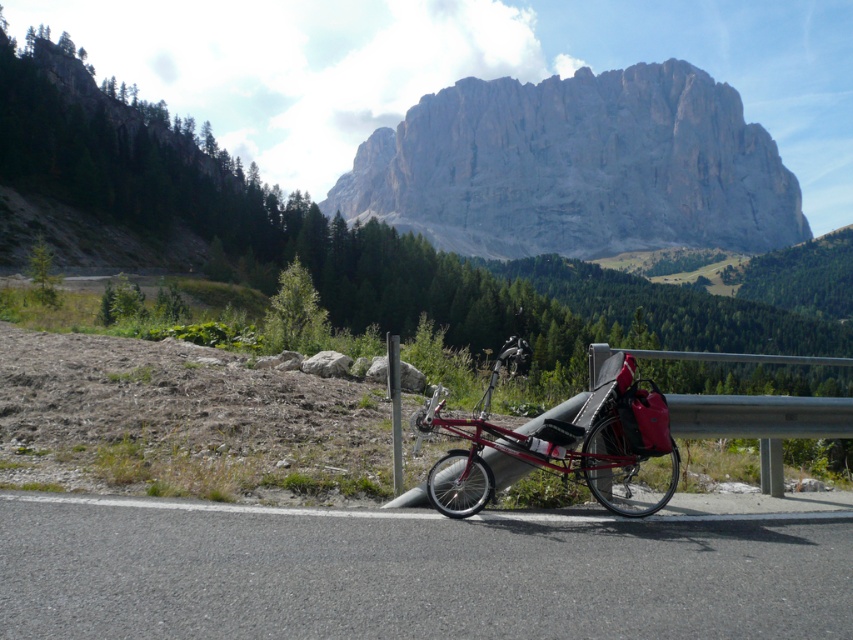
Question: Which object appears closest to the camera in this image?

Choices:
 (A) metallic gray pole at center
 (B) gray rocky mountain at upper center

Answer: (A)

Question: Can you confirm if black asphalt road at lower center is bigger than metallic gray pole at center?

Choices:
 (A) yes
 (B) no

Answer: (B)

Question: Does black asphalt road at lower center have a greater width compared to gray rocky mountain at upper center?

Choices:
 (A) no
 (B) yes

Answer: (A)

Question: Which of the following is the farthest from the observer?

Choices:
 (A) metallic gray pole at center
 (B) metallic red bicycle at center

Answer: (A)

Question: Is black asphalt road at lower center further to camera compared to metallic red bicycle at center?

Choices:
 (A) yes
 (B) no

Answer: (B)

Question: Considering the real-world distances, which object is farthest from the metallic red bicycle at center?

Choices:
 (A) metallic gray pole at center
 (B) gray rocky mountain at upper center

Answer: (B)